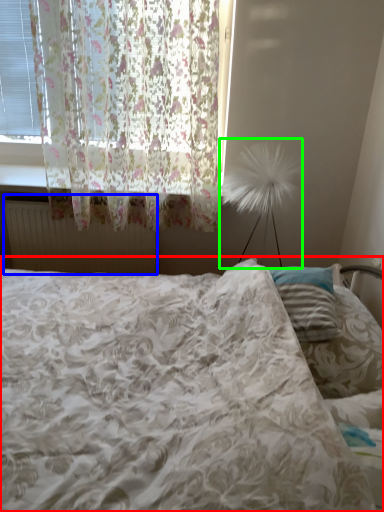
Question: Estimate the real-world distances between objects in this image. Which object is closer to bed (highlighted by a red box), radiator (highlighted by a blue box) or table lamp (highlighted by a green box)?

Choices:
 (A) radiator
 (B) table lamp

Answer: (A)